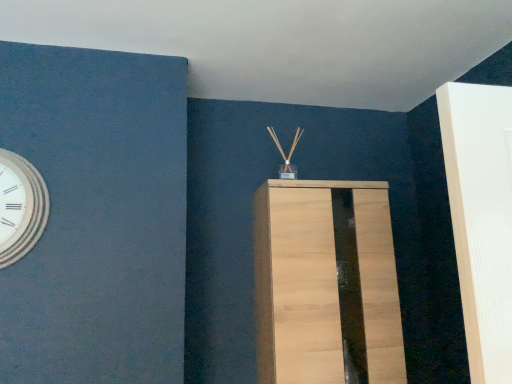
Question: Is light wood cabinet at center bigger or smaller than white wooden wall clock at left?

Choices:
 (A) small
 (B) big

Answer: (B)

Question: From the image's perspective, is light wood cabinet at center positioned above or below white wooden wall clock at left?

Choices:
 (A) above
 (B) below

Answer: (B)

Question: Is point (388, 251) closer or farther from the camera than point (26, 167)?

Choices:
 (A) closer
 (B) farther

Answer: (B)

Question: In terms of height, does white wooden wall clock at left look taller or shorter compared to light wood cabinet at center?

Choices:
 (A) tall
 (B) short

Answer: (B)

Question: Is point (32, 230) positioned closer to the camera than point (296, 225)?

Choices:
 (A) farther
 (B) closer

Answer: (B)

Question: Which is correct: white wooden wall clock at left is inside light wood cabinet at center, or outside of it?

Choices:
 (A) inside
 (B) outside

Answer: (B)

Question: In the image, is white wooden wall clock at left positioned in front of or behind light wood cabinet at center?

Choices:
 (A) behind
 (B) front

Answer: (B)